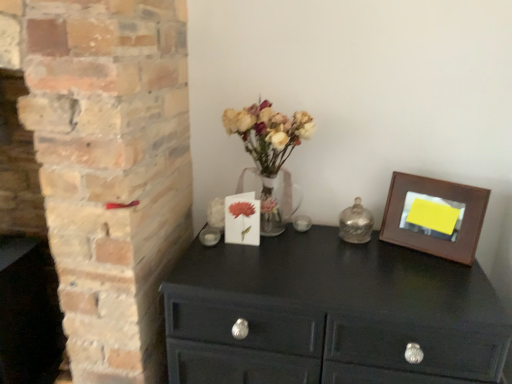
At what (x,y) coordinates should I click in order to perform the action: click on free space in front of shiny metallic bell at center-right. Please return your answer as a coordinate pair (x, y). Looking at the image, I should click on (370, 259).